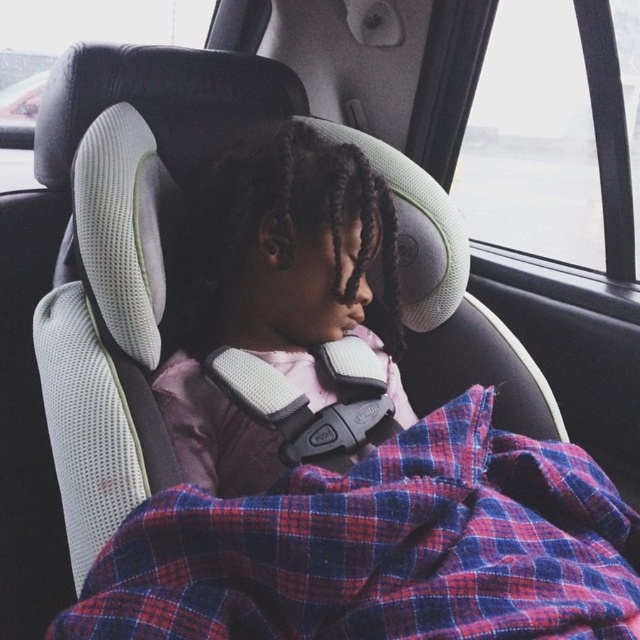
You are a parent checking on your child in the car. You notice the plaid fabric at center and the matte pink fabric at center. Which fabric is smaller in size?

The plaid fabric at center has a smaller size compared to matte pink fabric at center.

You are a parent checking if the plaid fabric at center and matte pink fabric at center are suitable for covering your child. Based on their sizes, which fabric would you choose to fully cover your child?

The plaid fabric at center is wider than the matte pink fabric at center, so it would be better to choose the plaid fabric at center to fully cover your child.